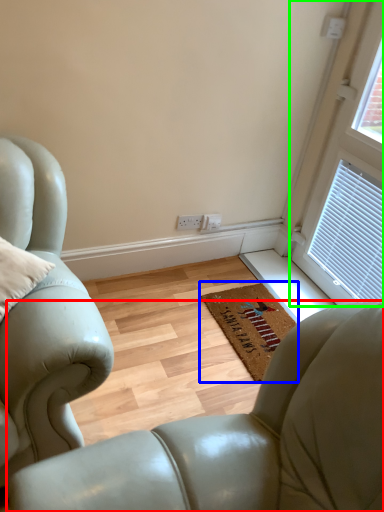
Question: Considering the real-world distances, which object is closest to chair (highlighted by a red box)? mat (highlighted by a blue box) or window (highlighted by a green box).

Choices:
 (A) mat
 (B) window

Answer: (A)